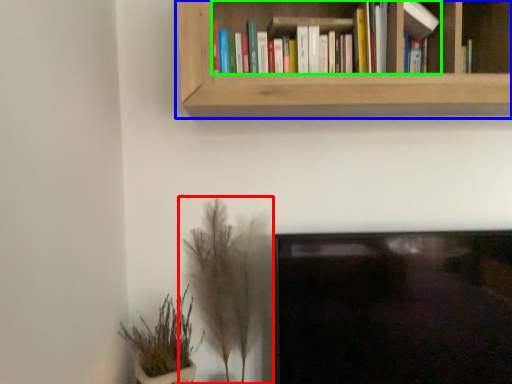
Question: Which object is the closest to the houseplant (highlighted by a red box)? Choose among these: bookcase (highlighted by a blue box) or book (highlighted by a green box).

Choices:
 (A) bookcase
 (B) book

Answer: (A)